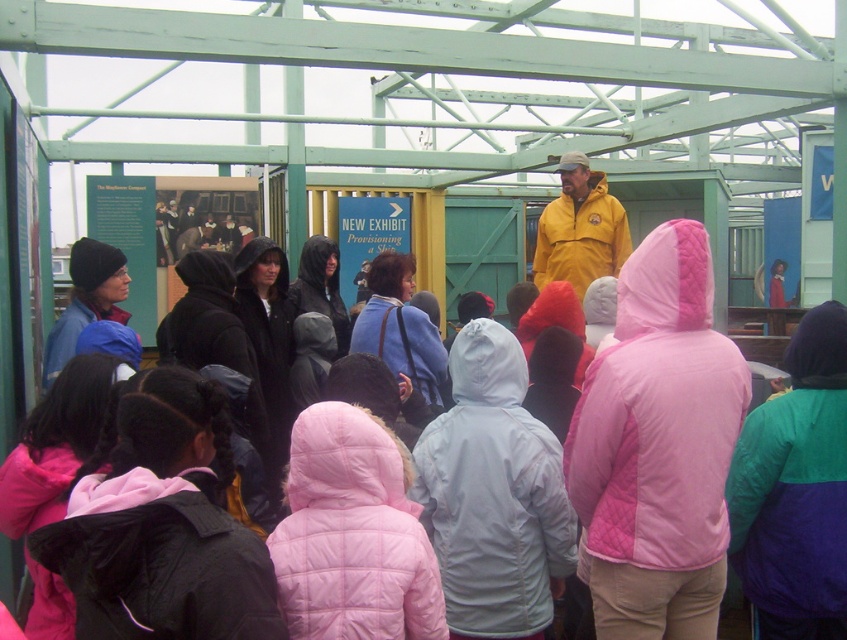
Can you confirm if light gray quilted jacket at center is positioned below blue quilted jacket at center?

Indeed, light gray quilted jacket at center is positioned under blue quilted jacket at center.

Can you confirm if light gray quilted jacket at center is positioned to the right of blue quilted jacket at center?

Indeed, light gray quilted jacket at center is positioned on the right side of blue quilted jacket at center.

What do you see at coordinates (493, 493) in the screenshot? The image size is (847, 640). I see `light gray quilted jacket at center` at bounding box center [493, 493].

The height and width of the screenshot is (640, 847). Identify the location of light gray quilted jacket at center. (493, 493).

Is yellow matte jacket at center positioned in front of blue quilted jacket at center?

That is False.

Does yellow matte jacket at center have a larger size compared to blue quilted jacket at center?

Yes.

Where is `yellow matte jacket at center`? yellow matte jacket at center is located at coordinates (580, 228).

Where is `yellow matte jacket at center`? The height and width of the screenshot is (640, 847). yellow matte jacket at center is located at coordinates (580, 228).

Who is positioned more to the left, pink quilted jacket at center or black quilted jacket at center?

black quilted jacket at center

Does point (673, 234) lie behind point (244, 368)?

No, (673, 234) is closer to viewer.

Locate an element on the screen. Image resolution: width=847 pixels, height=640 pixels. pink quilted jacket at center is located at coordinates (657, 413).